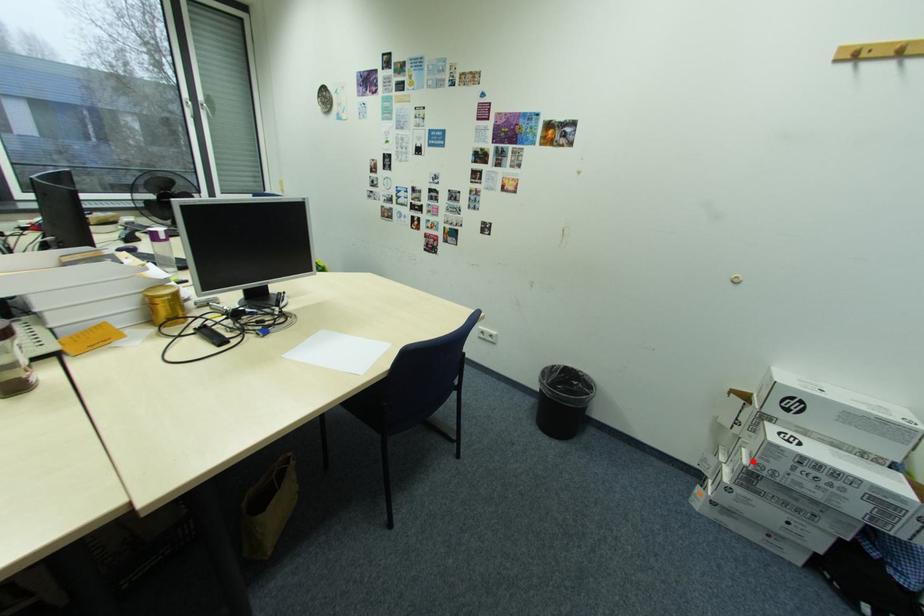
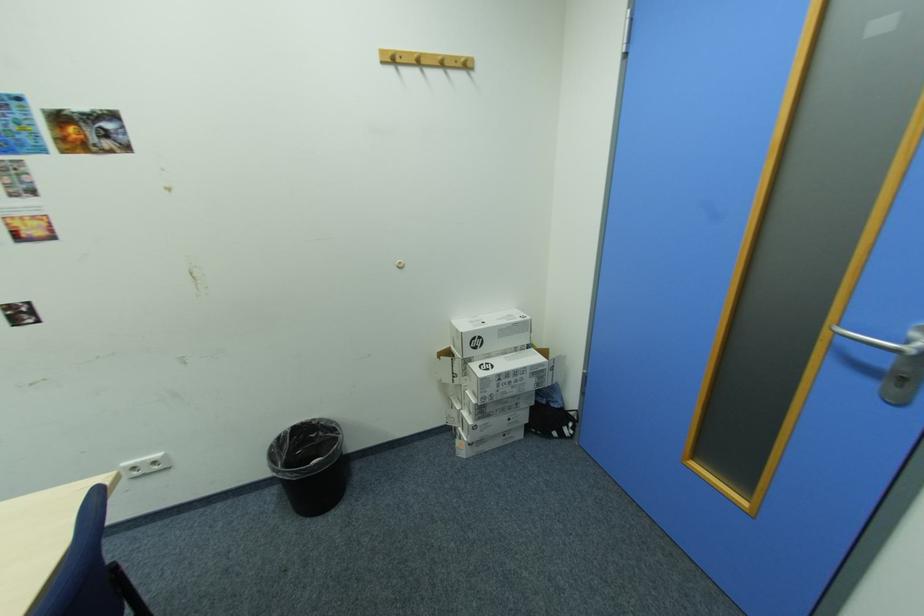
Question: A red point is marked in image1. In image2, is the corresponding 3D point closer to the camera or farther? Reply with the corresponding letter.

Choices:
 (A) The corresponding 3D point is closer.
 (B) The corresponding 3D point is farther.

Answer: (B)